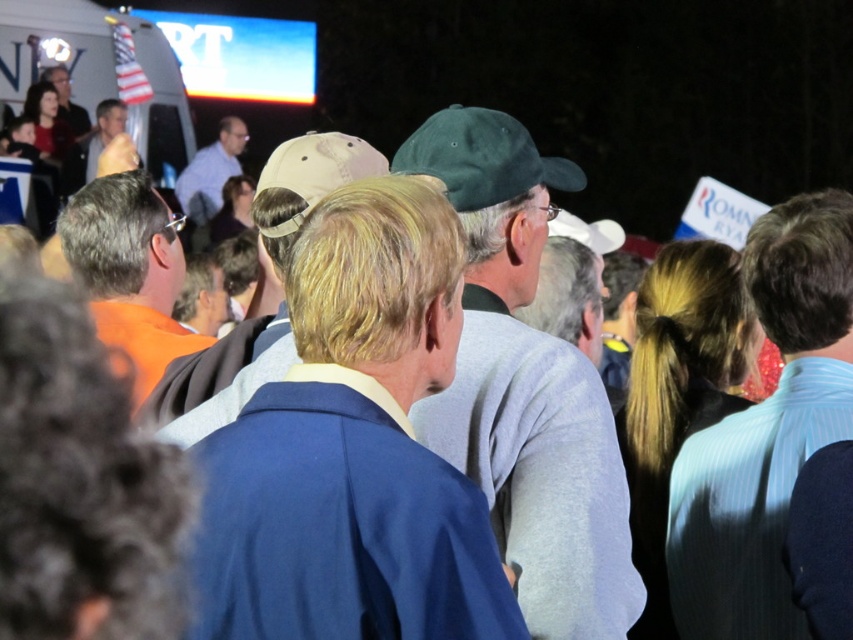
Is orange fabric shirt at left behind light brown leather jacket at center?

No, orange fabric shirt at left is closer to the viewer.

Is point (76, 243) farther from camera compared to point (115, 108)?

No, (76, 243) is closer to viewer.

Locate an element on the screen. orange fabric shirt at left is located at coordinates (129, 272).

Based on the photo, which is more to the right, light blue striped shirt at right or khaki fabric cap at center?

light blue striped shirt at right

You are a GUI agent. You are given a task and a screenshot of the screen. Output one action in this format:
    pyautogui.click(x=<x>, y=<y>)
    Task: Click on the light blue striped shirt at right
    This screenshot has width=853, height=640.
    Given the screenshot: What is the action you would take?
    766,432

Find the location of a particular element. light blue striped shirt at right is located at coordinates (766, 432).

Is khaki fabric cap at center taller than light brown leather jacket at center?

No, khaki fabric cap at center is not taller than light brown leather jacket at center.

Which is in front, point (160, 432) or point (107, 138)?

Point (160, 432)

At what (x,y) coordinates should I click in order to perform the action: click on khaki fabric cap at center. Please return your answer as a coordinate pair (x, y). Looking at the image, I should click on (216, 381).